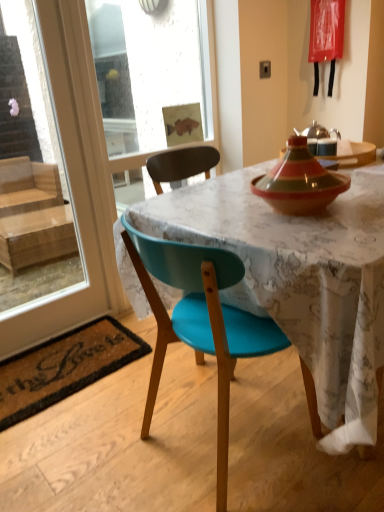
The width and height of the screenshot is (384, 512). I want to click on space that is in front of coir mat at lower left, so click(81, 446).